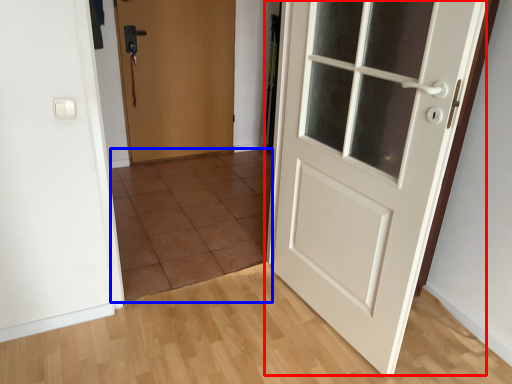
Question: Among these objects, which one is nearest to the camera, door (highlighted by a red box) or tile (highlighted by a blue box)?

Choices:
 (A) door
 (B) tile

Answer: (A)